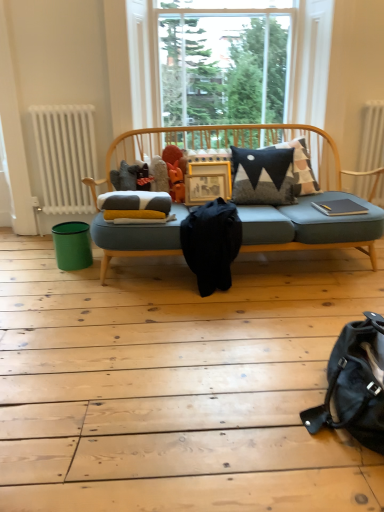
Measure the distance between point [328,202] and camera.

The depth of point [328,202] is 8.61 feet.

Image resolution: width=384 pixels, height=512 pixels. Describe the element at coordinates (176, 182) in the screenshot. I see `orange matte figurine at center` at that location.

What do you see at coordinates (372, 137) in the screenshot? I see `white textured radiator at upper right, the second radiator viewed from the left` at bounding box center [372, 137].

Image resolution: width=384 pixels, height=512 pixels. Identify the location of wooden frame at center. (207, 182).

What do you see at coordinates (72, 245) in the screenshot? The height and width of the screenshot is (512, 384). I see `teal plastic bin at lower left` at bounding box center [72, 245].

Image resolution: width=384 pixels, height=512 pixels. I want to click on hardcover book at right, so click(x=339, y=207).

From the picture: Is soft woolen blanket at center at the left side of white textured radiator at upper right, the second radiator viewed from the left?

Yes, soft woolen blanket at center is to the left of white textured radiator at upper right, the second radiator viewed from the left.

Is soft woolen blanket at center bigger than white textured radiator at upper right, the second radiator viewed from the left?

No.

What's the angular difference between soft woolen blanket at center and white textured radiator at upper right, the second radiator viewed from the left,'s facing directions?

5.24 degrees.

From the picture: Measure the distance between soft woolen blanket at center and white textured radiator at upper right, which ranks as the first radiator in right-to-left order.

soft woolen blanket at center and white textured radiator at upper right, which ranks as the first radiator in right-to-left order, are 1.57 meters apart from each other.

From the image's perspective, does teal plastic bin at lower left appear lower than black fabric messenger bag at center, the 1th messenger bag when ordered from top to bottom?

Indeed, from the image's perspective, teal plastic bin at lower left is shown beneath black fabric messenger bag at center, the 1th messenger bag when ordered from top to bottom.

Is teal plastic bin at lower left aimed at black fabric messenger bag at center, arranged as the first messenger bag when viewed from the back?

No, teal plastic bin at lower left is not oriented towards black fabric messenger bag at center, arranged as the first messenger bag when viewed from the back.

The width and height of the screenshot is (384, 512). Identify the location of teal that is below the black fabric messenger bag at center, arranged as the first messenger bag when viewed from the back (from the image's perspective). (72, 245).

Would you consider white radiator at left, the first radiator in the left-to-right sequence, to be distant from black fabric messenger bag at center, arranged as the first messenger bag when viewed from the back?

Yes, white radiator at left, the first radiator in the left-to-right sequence, and black fabric messenger bag at center, arranged as the first messenger bag when viewed from the back, are located far from each other.

Based on the photo, who is taller, white radiator at left, marked as the 2th radiator in a right-to-left arrangement, or black fabric messenger bag at center, the 1th messenger bag when ordered from top to bottom?

white radiator at left, marked as the 2th radiator in a right-to-left arrangement, is taller.

Locate an element on the screen. This screenshot has height=512, width=384. radiator to the left of black fabric messenger bag at center, positioned as the second messenger bag in right-to-left order is located at coordinates (65, 156).

From the image's perspective, is white radiator at left, marked as the 2th radiator in a right-to-left arrangement, under black fabric messenger bag at center, which appears as the 1th messenger bag when viewed from the left?

No, from the image's perspective, white radiator at left, marked as the 2th radiator in a right-to-left arrangement, is not beneath black fabric messenger bag at center, which appears as the 1th messenger bag when viewed from the left.

Does black fabric messenger bag at center, the 2th messenger bag in the front-to-back sequence, have a greater height compared to white textured radiator at upper right, which ranks as the first radiator in right-to-left order?

Incorrect, the height of black fabric messenger bag at center, the 2th messenger bag in the front-to-back sequence, is not larger of that of white textured radiator at upper right, which ranks as the first radiator in right-to-left order.

How many degrees apart are the facing directions of black fabric messenger bag at center, the 1th messenger bag when ordered from top to bottom, and white textured radiator at upper right, which ranks as the first radiator in right-to-left order?

5.24 degrees separate the facing orientations of black fabric messenger bag at center, the 1th messenger bag when ordered from top to bottom, and white textured radiator at upper right, which ranks as the first radiator in right-to-left order.

Is black fabric messenger bag at center, arranged as the first messenger bag when viewed from the back, positioned with its back to white textured radiator at upper right, which ranks as the first radiator in right-to-left order?

No.

Based on the photo, can hardcover book at right be found inside white textured radiator at upper right, the second radiator viewed from the left?

No, hardcover book at right is not inside white textured radiator at upper right, the second radiator viewed from the left.

Is white textured radiator at upper right, which ranks as the first radiator in right-to-left order, at the left side of hardcover book at right?

No.

Is hardcover book at right at the back of white textured radiator at upper right, which ranks as the first radiator in right-to-left order?

That's not correct — white textured radiator at upper right, which ranks as the first radiator in right-to-left order, is not looking away from hardcover book at right.

Is point (357, 192) positioned after point (313, 205)?

Yes.

Is point (87, 230) positioned in front of point (332, 202)?

Yes, point (87, 230) is in front of point (332, 202).

Is teal plastic bin at lower left oriented away from hardcover book at right?

teal plastic bin at lower left does not have its back to hardcover book at right.

From a real-world perspective, who is located higher, teal plastic bin at lower left or hardcover book at right?

In real-world perspective, hardcover book at right is above.

In the scene shown: Is clear glass window at center looking in the opposite direction of hardcover book at right?

clear glass window at center does not have its back to hardcover book at right.

Is clear glass window at center outside of hardcover book at right?

clear glass window at center is positioned outside hardcover book at right.

Between clear glass window at center and hardcover book at right, which one has smaller size?

Smaller between the two is hardcover book at right.

Locate an element on the screen. mattress in front of the white textured radiator at upper right, which ranks as the first radiator in right-to-left order is located at coordinates (135, 203).

Locate an element on the screen. the 1st messenger bag to the right of the teal plastic bin at lower left, counting from the anchor's position is located at coordinates (211, 244).

When comparing their distances from soft woolen blanket at center, does black fabric messenger bag at center, the 1th messenger bag when ordered from top to bottom, or hardcover book at right seem closer?

black fabric messenger bag at center, the 1th messenger bag when ordered from top to bottom, is positioned closer to the anchor soft woolen blanket at center.

Estimate the real-world distances between objects in this image. Which object is further from black leather messenger bag at lower right, marked as the second messenger bag in a top-to-bottom arrangement, orange matte figurine at center or clear glass window at center?

Based on the image, clear glass window at center appears to be further to black leather messenger bag at lower right, marked as the second messenger bag in a top-to-bottom arrangement.

Based on the photo, which object lies nearer to the anchor point white radiator at left, the first radiator in the left-to-right sequence, black fabric messenger bag at center, the 1th messenger bag when ordered from top to bottom, or soft woolen blanket at center?

Among the two, soft woolen blanket at center is located nearer to white radiator at left, the first radiator in the left-to-right sequence.

Estimate the real-world distances between objects in this image. Which object is further from black leather messenger bag at lower right, arranged as the 1th messenger bag when viewed from the front, clear glass window at center or white textured radiator at upper right, the second radiator viewed from the left?

The object further to black leather messenger bag at lower right, arranged as the 1th messenger bag when viewed from the front, is clear glass window at center.

From the image, which object appears to be nearer to hardcover book at right, soft woolen blanket at center or black fabric messenger bag at center, which appears as the 1th messenger bag when viewed from the left?

black fabric messenger bag at center, which appears as the 1th messenger bag when viewed from the left, is closer to hardcover book at right.

Estimate the real-world distances between objects in this image. Which object is further from orange matte figurine at center, white textured radiator at upper right, which ranks as the first radiator in right-to-left order, or soft woolen blanket at center?

white textured radiator at upper right, which ranks as the first radiator in right-to-left order, lies further to orange matte figurine at center than the other object.

When comparing their distances from soft woolen blanket at center, does white radiator at left, marked as the 2th radiator in a right-to-left arrangement, or black leather messenger bag at lower right, which ranks as the first messenger bag in bottom-to-top order, seem closer?

white radiator at left, marked as the 2th radiator in a right-to-left arrangement, lies closer to soft woolen blanket at center than the other object.

From the image, which object appears to be nearer to hardcover book at right, white radiator at left, marked as the 2th radiator in a right-to-left arrangement, or orange matte figurine at center?

Based on the image, orange matte figurine at center appears to be nearer to hardcover book at right.

What are the coordinates of `toy between clear glass window at center and soft woolen blanket at center in the up-down direction` in the screenshot? It's located at (176, 182).

You are a GUI agent. You are given a task and a screenshot of the screen. Output one action in this format:
    pyautogui.click(x=<x>, y=<y>)
    Task: Click on the toy situated between teal plastic bin at lower left and white textured radiator at upper right, the second radiator viewed from the left, from left to right
    This screenshot has width=384, height=512.
    Given the screenshot: What is the action you would take?
    176,182

Find the location of `mattress between black fabric messenger bag at center, arranged as the first messenger bag when viewed from the back, and orange matte figurine at center in the front-back direction`. mattress between black fabric messenger bag at center, arranged as the first messenger bag when viewed from the back, and orange matte figurine at center in the front-back direction is located at coordinates (135, 203).

This screenshot has height=512, width=384. I want to click on teal positioned between soft woolen blanket at center and white radiator at left, the first radiator in the left-to-right sequence, from near to far, so click(x=72, y=245).